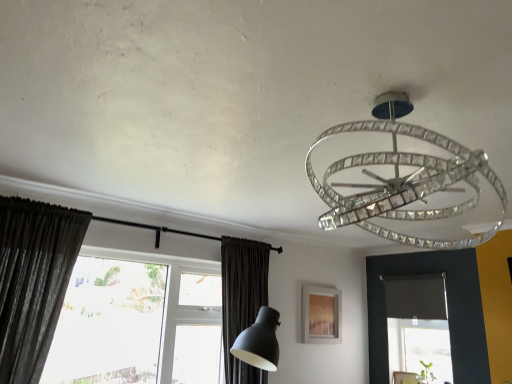
Where is `transparent glass window at lower left`? Image resolution: width=512 pixels, height=384 pixels. transparent glass window at lower left is located at coordinates (138, 321).

What is the approximate width of dark matte fabric curtain at lower center, arranged as the 1th curtain when viewed from the back?

The width of dark matte fabric curtain at lower center, arranged as the 1th curtain when viewed from the back, is 13.45 inches.

The height and width of the screenshot is (384, 512). Find the location of `clear crystal chandelier at upper center`. clear crystal chandelier at upper center is located at coordinates (403, 178).

What do you see at coordinates (321, 315) in the screenshot?
I see `wooden frame at center` at bounding box center [321, 315].

Identify the location of transparent glass window at lower left. This screenshot has width=512, height=384. (138, 321).

Can you confirm if clear crystal chandelier at upper center is positioned to the right of dark gray textured curtain at left, the 2th curtain from the back?

Indeed, clear crystal chandelier at upper center is positioned on the right side of dark gray textured curtain at left, the 2th curtain from the back.

Can you confirm if clear crystal chandelier at upper center is shorter than dark gray textured curtain at left, the second curtain positioned from the right?

Correct, clear crystal chandelier at upper center is not as tall as dark gray textured curtain at left, the second curtain positioned from the right.

Is clear crystal chandelier at upper center bigger than dark gray textured curtain at left, the 1th curtain from the front?

No.

Considering the positions of objects clear crystal chandelier at upper center and transparent glass window at lower left in the image provided, who is more to the left, clear crystal chandelier at upper center or transparent glass window at lower left?

From the viewer's perspective, transparent glass window at lower left appears more on the left side.

Is clear crystal chandelier at upper center directly adjacent to transparent glass window at lower left?

No, clear crystal chandelier at upper center is not beside transparent glass window at lower left.

Is clear crystal chandelier at upper center wider or thinner than transparent glass window at lower left?

Considering their sizes, clear crystal chandelier at upper center looks slimmer than transparent glass window at lower left.

Does point (416, 210) come farther from viewer compared to point (104, 365)?

No.

Is transparent glass window at lower left located within dark matte fabric curtain at lower center, arranged as the second curtain when viewed from the front?

Actually, transparent glass window at lower left is outside dark matte fabric curtain at lower center, arranged as the second curtain when viewed from the front.

Does point (248, 322) appear closer or farther from the camera than point (189, 318)?

Point (248, 322) is positioned closer to the camera compared to point (189, 318).

From a real-world perspective, is dark matte fabric curtain at lower center, arranged as the 1th curtain when viewed from the back, below transparent glass window at lower left?

No, from a real-world perspective, dark matte fabric curtain at lower center, arranged as the 1th curtain when viewed from the back, is not beneath transparent glass window at lower left.

Would you say dark gray textured curtain at left, the 1th curtain from the front, contains wooden frame at center?

No.

Can you confirm if dark gray textured curtain at left, the 1th curtain positioned from the left, is bigger than wooden frame at center?

Correct, dark gray textured curtain at left, the 1th curtain positioned from the left, is larger in size than wooden frame at center.

Can you confirm if dark gray textured curtain at left, the second curtain positioned from the right, is positioned to the right of wooden frame at center?

Incorrect, dark gray textured curtain at left, the second curtain positioned from the right, is not on the right side of wooden frame at center.

From the image's perspective, would you say dark gray textured curtain at left, the 1th curtain from the front, is shown under wooden frame at center?

Actually, dark gray textured curtain at left, the 1th curtain from the front, appears above wooden frame at center in the image.

Does dark matte fabric curtain at lower center, arranged as the 1th curtain when viewed from the right, have a lesser height compared to clear crystal chandelier at upper center?

No.

Considering the relative sizes of dark matte fabric curtain at lower center, arranged as the second curtain when viewed from the front, and clear crystal chandelier at upper center in the image provided, is dark matte fabric curtain at lower center, arranged as the second curtain when viewed from the front, wider than clear crystal chandelier at upper center?

No.

Is the position of dark matte fabric curtain at lower center, arranged as the 1th curtain when viewed from the back, less distant than that of clear crystal chandelier at upper center?

No, dark matte fabric curtain at lower center, arranged as the 1th curtain when viewed from the back, is further to the viewer.

Is dark matte fabric curtain at lower center, arranged as the 1th curtain when viewed from the back, oriented towards clear crystal chandelier at upper center?

No, dark matte fabric curtain at lower center, arranged as the 1th curtain when viewed from the back, is not turned towards clear crystal chandelier at upper center.

From the image's perspective, is transparent glass window at lower left above or below clear crystal chandelier at upper center?

Based on their image positions, transparent glass window at lower left is located beneath clear crystal chandelier at upper center.

From a real-world perspective, relative to clear crystal chandelier at upper center, is transparent glass window at lower left vertically above or below?

transparent glass window at lower left is below clear crystal chandelier at upper center.

Between transparent glass window at lower left and clear crystal chandelier at upper center, which one has less height?

With less height is clear crystal chandelier at upper center.

Can you confirm if transparent glass window at lower left is wider than clear crystal chandelier at upper center?

Yes.

From the image's perspective, which one is positioned lower, dark matte fabric curtain at lower center, arranged as the second curtain when viewed from the front, or wooden frame at center?

wooden frame at center.

From a real-world perspective, is dark matte fabric curtain at lower center, arranged as the 1th curtain when viewed from the back, under wooden frame at center?

Indeed, from a real-world perspective, dark matte fabric curtain at lower center, arranged as the 1th curtain when viewed from the back, is positioned beneath wooden frame at center.

This screenshot has width=512, height=384. I want to click on the 1st curtain counting from the left side of the wooden frame at center, so click(242, 300).

Is point (258, 246) closer or farther from the camera than point (331, 308)?

Point (258, 246) appears to be closer to the viewer than point (331, 308).

Image resolution: width=512 pixels, height=384 pixels. I want to click on lamp above the dark gray textured curtain at left, the 1th curtain from the front (from the image's perspective), so click(x=403, y=178).

The width and height of the screenshot is (512, 384). There is a transparent glass window at lower left. What are the coordinates of `lamp above it (from a real-world perspective)` in the screenshot? It's located at (403, 178).

Considering their positions, is transparent glass window at lower left positioned further to wooden frame at center than clear crystal chandelier at upper center?

Based on the image, clear crystal chandelier at upper center appears to be further to wooden frame at center.

Which object lies nearer to the anchor point clear crystal chandelier at upper center, dark matte fabric curtain at lower center, arranged as the 1th curtain when viewed from the back, or wooden frame at center?

The object closer to clear crystal chandelier at upper center is dark matte fabric curtain at lower center, arranged as the 1th curtain when viewed from the back.

From the image, which object appears to be farther from transparent glass window at lower left, clear crystal chandelier at upper center or dark gray textured curtain at left, the 1th curtain from the front?

clear crystal chandelier at upper center is further to transparent glass window at lower left.

From the picture: Estimate the real-world distances between objects in this image. Which object is further from transparent glass window at lower left, dark gray textured curtain at left, the 2th curtain from the back, or wooden frame at center?

The object further to transparent glass window at lower left is wooden frame at center.

Based on their spatial positions, is transparent glass window at lower left or dark matte fabric curtain at lower center, arranged as the 1th curtain when viewed from the back, further from wooden frame at center?

Based on the image, transparent glass window at lower left appears to be further to wooden frame at center.

Looking at the image, which one is located closer to dark gray textured curtain at left, the 1th curtain from the front, wooden frame at center or transparent glass window at lower left?

transparent glass window at lower left.

Which object lies further to the anchor point dark gray textured curtain at left, the 2th curtain from the back, transparent glass window at lower left or wooden frame at center?

wooden frame at center lies further to dark gray textured curtain at left, the 2th curtain from the back, than the other object.

Estimate the real-world distances between objects in this image. Which object is closer to dark matte fabric curtain at lower center, arranged as the 1th curtain when viewed from the back, wooden frame at center or clear crystal chandelier at upper center?

Among the two, wooden frame at center is located nearer to dark matte fabric curtain at lower center, arranged as the 1th curtain when viewed from the back.

This screenshot has width=512, height=384. What are the coordinates of `window located between dark gray textured curtain at left, the second curtain positioned from the right, and clear crystal chandelier at upper center in the left-right direction` in the screenshot? It's located at 138,321.

The width and height of the screenshot is (512, 384). Find the location of `window positioned between clear crystal chandelier at upper center and dark matte fabric curtain at lower center, arranged as the 1th curtain when viewed from the right, from near to far`. window positioned between clear crystal chandelier at upper center and dark matte fabric curtain at lower center, arranged as the 1th curtain when viewed from the right, from near to far is located at coordinates (138, 321).

Locate an element on the screen. The width and height of the screenshot is (512, 384). curtain between dark gray textured curtain at left, the 2th curtain from the back, and wooden frame at center from left to right is located at coordinates (242, 300).

Where is `window between dark gray textured curtain at left, the 2th curtain from the back, and wooden frame at center from left to right`? The width and height of the screenshot is (512, 384). window between dark gray textured curtain at left, the 2th curtain from the back, and wooden frame at center from left to right is located at coordinates (138, 321).